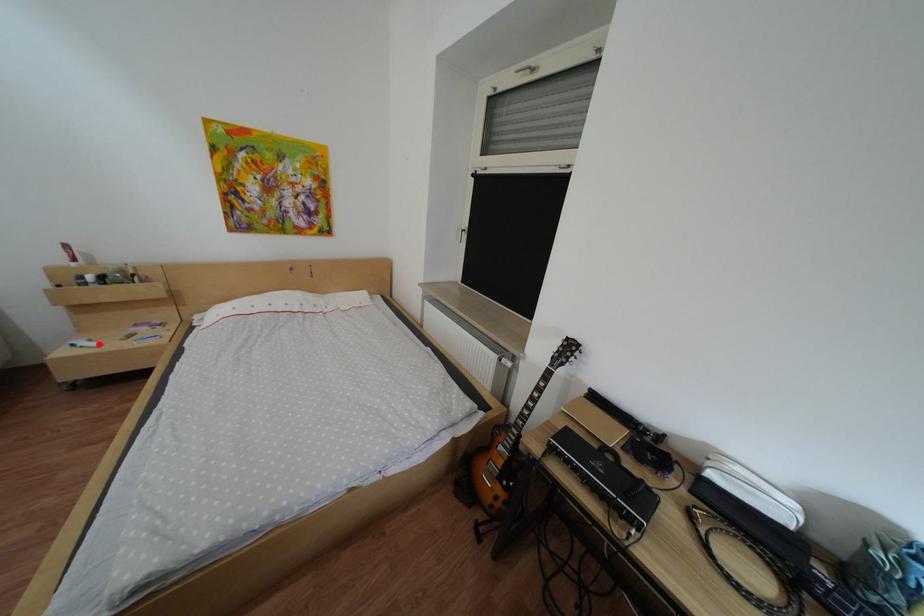
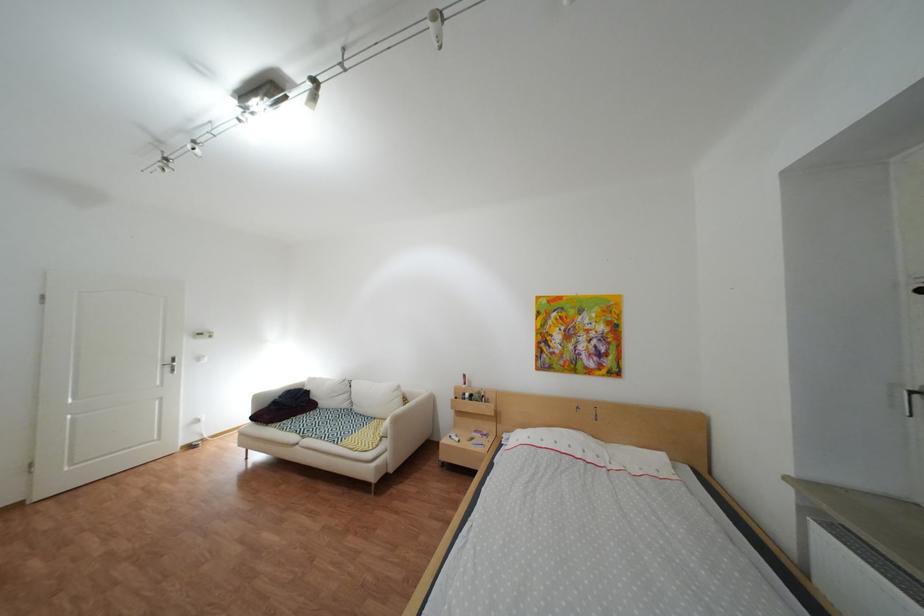
The point at the highlighted location is marked in the first image. Where is the corresponding point in the second image?

(469, 438)